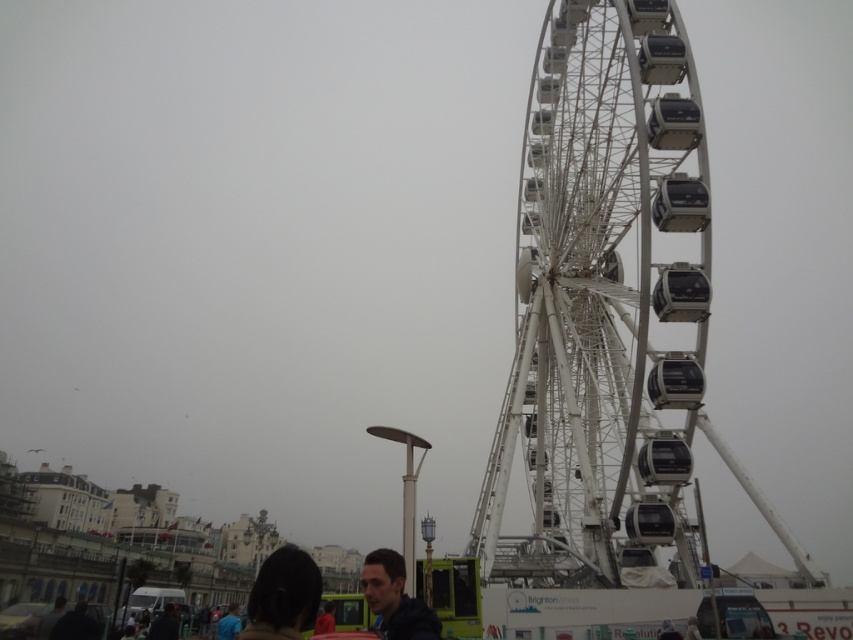
You are standing at the point marked as point (170, 632) in the image. A Ferris wheel is located in the background. If you want to walk directly towards the Ferris wheel, which direction should you head?

Since the Ferris wheel is in the background and the point is in the foreground, you should walk towards the background direction to reach the Ferris wheel.

You are standing at the base of the Ferris wheel and want to find someone wearing a matte black jacket at lower center. There is also a person with dark hair at lower center in the area. Which of these two people is farther away from you?

The dark hair at lower center is 36.13 meters away from the matte black jacket at lower center. Since you are at the base of the Ferris wheel, the person farther away would depend on their positions relative to you. However, based on the given distance between them, if both are in the same general area, the one farther from the jacket might be farther from you. But without knowing your exact position, it is impossible to determine definitively.

You are standing on the boardwalk and see two people ahead of you. One has dark hair at lower center and the other is wearing a blue fabric shirt at lower left. Which person is closer to your left side?

The dark hair at lower center is positioned on the left side of blue fabric shirt at lower left, so the dark hair at lower center is closer to your left side.